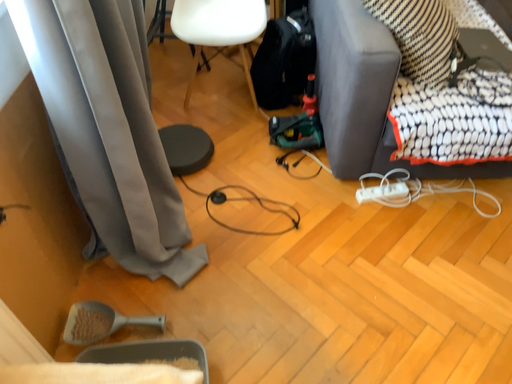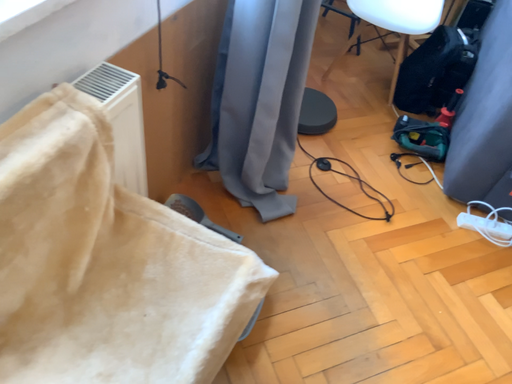
Question: Which way did the camera rotate in the video?

Choices:
 (A) rotated left
 (B) rotated right

Answer: (A)